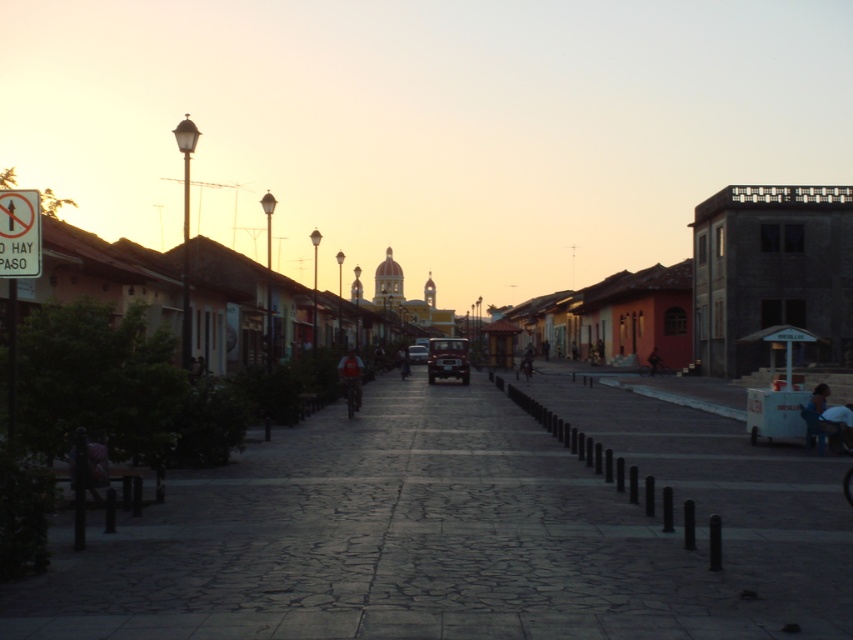
You are standing on the street and want to greet the pink fabric person at lower left and the red fabric shirt at center. Which person should you approach first if you are moving from the top of the image towards the bottom?

You should approach the pink fabric person at lower left first because it is located below the red fabric shirt at center, so it will be closer as you move downward.

You are standing on the street and see the dark blue jeans at lower right and the pink fabric person at lower left. Which one is closer to you?

The dark blue jeans at lower right is closer to you because the pink fabric person at lower left is behind it.